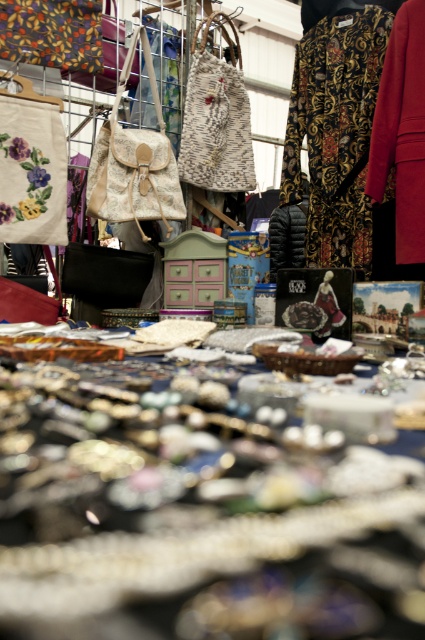
Where is the patterned fabric dress at upper right located in the image?

The patterned fabric dress at upper right is located at point (334, 129).

You are a customer at a flea market and want to buy both the patterned fabric dress at upper right and the matte black puffer jacket at center. However, you can only carry one item at a time. If you first pick up the item that is closer to you, which one will you pick first?

The patterned fabric dress at upper right is closer to the viewer than the matte black puffer jacket at center, so you will pick up the patterned fabric dress at upper right first.